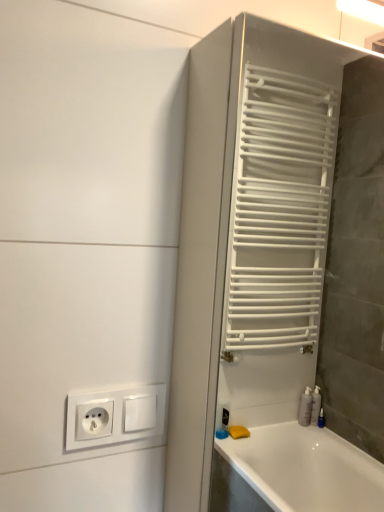
Question: From the image's perspective, is white matte towel rack at right positioned above or below white plastic socket at lower left?

Choices:
 (A) below
 (B) above

Answer: (B)

Question: Considering the positions of white matte towel rack at right and white plastic socket at lower left in the image, is white matte towel rack at right taller or shorter than white plastic socket at lower left?

Choices:
 (A) tall
 (B) short

Answer: (A)

Question: From a real-world perspective, is white matte towel rack at right above or below white plastic socket at lower left?

Choices:
 (A) above
 (B) below

Answer: (A)

Question: From a real-world perspective, is white plastic socket at lower left positioned above or below white matte towel rack at right?

Choices:
 (A) above
 (B) below

Answer: (B)

Question: From the image's perspective, relative to white matte towel rack at right, is white plastic socket at lower left above or below?

Choices:
 (A) below
 (B) above

Answer: (A)

Question: Looking at the image, does white plastic socket at lower left seem bigger or smaller compared to white matte towel rack at right?

Choices:
 (A) small
 (B) big

Answer: (A)

Question: Considering their positions, is white plastic socket at lower left located in front of or behind white matte towel rack at right?

Choices:
 (A) behind
 (B) front

Answer: (A)